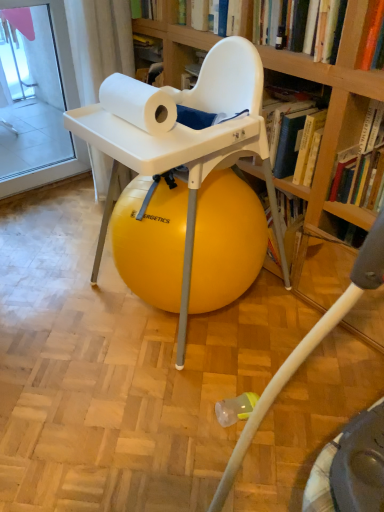
Question: From a real-world perspective, is white matte paper towel at upper center under hardcover book at upper center, marked as the 1th book in a top-to-bottom arrangement?

Choices:
 (A) yes
 (B) no

Answer: (A)

Question: Is the position of white matte paper towel at upper center more distant than that of hardcover book at upper center, arranged as the 1th book when viewed from the left?

Choices:
 (A) no
 (B) yes

Answer: (A)

Question: Is white matte paper towel at upper center positioned far away from hardcover book at upper center, marked as the 1th book in a top-to-bottom arrangement?

Choices:
 (A) yes
 (B) no

Answer: (B)

Question: From the image's perspective, is white matte paper towel at upper center beneath hardcover book at upper center, the 2th book when ordered from right to left?

Choices:
 (A) yes
 (B) no

Answer: (A)

Question: Can you confirm if white matte paper towel at upper center is shorter than hardcover book at upper center, the 2th book positioned from the bottom?

Choices:
 (A) no
 (B) yes

Answer: (B)

Question: Choose the correct answer: Is hardcover book at upper right, acting as the 1th book starting from the bottom, inside hardcover book at upper center, marked as the 1th book in a top-to-bottom arrangement, or outside it?

Choices:
 (A) inside
 (B) outside

Answer: (B)

Question: Considering their positions, is hardcover book at upper right, which appears as the second book when viewed from the left, located in front of or behind hardcover book at upper center, marked as the 1th book in a top-to-bottom arrangement?

Choices:
 (A) behind
 (B) front

Answer: (B)

Question: In terms of size, does hardcover book at upper right, acting as the 1th book starting from the bottom, appear bigger or smaller than hardcover book at upper center, the 2th book when ordered from right to left?

Choices:
 (A) big
 (B) small

Answer: (A)

Question: Is hardcover book at upper right, which appears as the second book when viewed from the left, wider or thinner than hardcover book at upper center, the 2th book positioned from the bottom?

Choices:
 (A) wide
 (B) thin

Answer: (B)

Question: Relative to white matte paper towel at upper center, is hardcover book at upper right, acting as the 1th book starting from the bottom, in front or behind?

Choices:
 (A) behind
 (B) front

Answer: (A)

Question: From the image's perspective, is hardcover book at upper right, acting as the 1th book starting from the right, above or below white matte paper towel at upper center?

Choices:
 (A) below
 (B) above

Answer: (A)

Question: Would you say hardcover book at upper right, acting as the 1th book starting from the bottom, is to the left or to the right of white matte paper towel at upper center in the picture?

Choices:
 (A) left
 (B) right

Answer: (B)

Question: Looking at their shapes, would you say hardcover book at upper right, acting as the 1th book starting from the bottom, is wider or thinner than white matte paper towel at upper center?

Choices:
 (A) wide
 (B) thin

Answer: (A)

Question: From a real-world perspective, is yellow rubber ball at center positioned above or below hardcover book at upper right, acting as the 1th book starting from the right?

Choices:
 (A) below
 (B) above

Answer: (A)

Question: Do you think yellow rubber ball at center is within hardcover book at upper right, which is the second book in top-to-bottom order, or outside of it?

Choices:
 (A) outside
 (B) inside

Answer: (A)